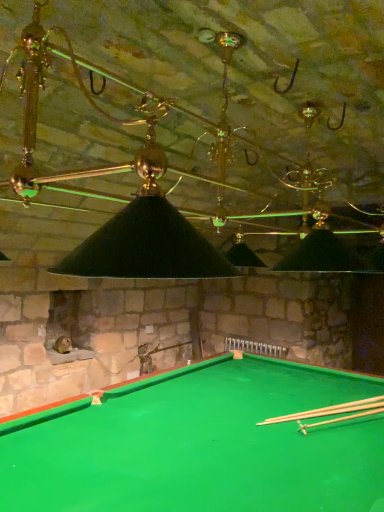
Identify the location of green felt billiard table at lower center. The width and height of the screenshot is (384, 512). (200, 445).

Describe the element at coordinates (200, 445) in the screenshot. The height and width of the screenshot is (512, 384). I see `green felt billiard table at lower center` at that location.

Describe the element at coordinates (333, 411) in the screenshot. This screenshot has height=512, width=384. I see `light brown wooden cue at bottom right` at that location.

This screenshot has height=512, width=384. I want to click on light brown wooden cue at bottom right, so click(x=333, y=411).

Image resolution: width=384 pixels, height=512 pixels. In order to click on green felt billiard table at lower center in this screenshot , I will do [x=200, y=445].

Is green felt billiard table at lower center at the right side of light brown wooden cue at bottom right?

No, green felt billiard table at lower center is not to the right of light brown wooden cue at bottom right.

Considering their positions, is green felt billiard table at lower center located in front of or behind light brown wooden cue at bottom right?

In the image, green felt billiard table at lower center appears in front of light brown wooden cue at bottom right.

Considering the positions of point (352, 439) and point (340, 408), is point (352, 439) closer or farther from the camera than point (340, 408)?

Point (352, 439) is closer to the camera than point (340, 408).

From the image's perspective, relative to light brown wooden cue at bottom right, is green felt billiard table at lower center above or below?

From the image's perspective, green felt billiard table at lower center appears below light brown wooden cue at bottom right.

From a real-world perspective, which is physically above, green felt billiard table at lower center or light brown wooden cue at bottom right?

light brown wooden cue at bottom right, from a real-world perspective.

Is green felt billiard table at lower center wider or thinner than light brown wooden cue at bottom right?

Clearly, green felt billiard table at lower center has more width compared to light brown wooden cue at bottom right.

Between green felt billiard table at lower center and light brown wooden cue at bottom right, which one has less height?

light brown wooden cue at bottom right.

Is green felt billiard table at lower center bigger than light brown wooden cue at bottom right?

Correct, green felt billiard table at lower center is larger in size than light brown wooden cue at bottom right.

Is green felt billiard table at lower center inside or outside of light brown wooden cue at bottom right?

The correct answer is: outside.

Are green felt billiard table at lower center and light brown wooden cue at bottom right far apart?

No, green felt billiard table at lower center is not far away from light brown wooden cue at bottom right.

Consider the image. Is green felt billiard table at lower center looking in the opposite direction of light brown wooden cue at bottom right?

No, light brown wooden cue at bottom right is not at the back of green felt billiard table at lower center.

Based on the photo, how far apart are green felt billiard table at lower center and light brown wooden cue at bottom right?

green felt billiard table at lower center is 49.87 centimeters from light brown wooden cue at bottom right.

Find the location of a particular element. cue that appears on the right of green felt billiard table at lower center is located at coordinates (333, 411).

Can you confirm if light brown wooden cue at bottom right is positioned to the right of green felt billiard table at lower center?

Indeed, light brown wooden cue at bottom right is positioned on the right side of green felt billiard table at lower center.

Is light brown wooden cue at bottom right closer to the viewer compared to green felt billiard table at lower center?

No, light brown wooden cue at bottom right is further to the viewer.

Considering the points (351, 417) and (117, 467), which point is behind, point (351, 417) or point (117, 467)?

The point (351, 417) is behind.

From the image's perspective, is light brown wooden cue at bottom right over green felt billiard table at lower center?

Indeed, from the image's perspective, light brown wooden cue at bottom right is shown above green felt billiard table at lower center.

From a real-world perspective, is light brown wooden cue at bottom right above or below green felt billiard table at lower center?

From a real-world perspective, light brown wooden cue at bottom right is physically above green felt billiard table at lower center.

Does light brown wooden cue at bottom right have a greater width compared to green felt billiard table at lower center?

In fact, light brown wooden cue at bottom right might be narrower than green felt billiard table at lower center.

Between light brown wooden cue at bottom right and green felt billiard table at lower center, which one has less height?

Standing shorter between the two is light brown wooden cue at bottom right.

Between light brown wooden cue at bottom right and green felt billiard table at lower center, which one has smaller size?

light brown wooden cue at bottom right.

Can green felt billiard table at lower center be found inside light brown wooden cue at bottom right?

No, green felt billiard table at lower center is not a part of light brown wooden cue at bottom right.

Are light brown wooden cue at bottom right and green felt billiard table at lower center beside each other?

light brown wooden cue at bottom right is not next to green felt billiard table at lower center, and they're not touching.

Is green felt billiard table at lower center at the back of light brown wooden cue at bottom right?

Correct, light brown wooden cue at bottom right is looking away from green felt billiard table at lower center.

Can you tell me how much light brown wooden cue at bottom right and green felt billiard table at lower center differ in facing direction?

light brown wooden cue at bottom right and green felt billiard table at lower center are facing 60.3 degrees away from each other.

How much distance is there between light brown wooden cue at bottom right and green felt billiard table at lower center?

The distance of light brown wooden cue at bottom right from green felt billiard table at lower center is 49.87 centimeters.

What are the coordinates of `billiard table located on the left of light brown wooden cue at bottom right` in the screenshot? It's located at (200, 445).

Identify the location of cue lying on the right of green felt billiard table at lower center. (333, 411).

At what (x,y) coordinates should I click in order to perform the action: click on billiard table below the light brown wooden cue at bottom right (from the image's perspective). Please return your answer as a coordinate pair (x, y). The width and height of the screenshot is (384, 512). Looking at the image, I should click on (200, 445).